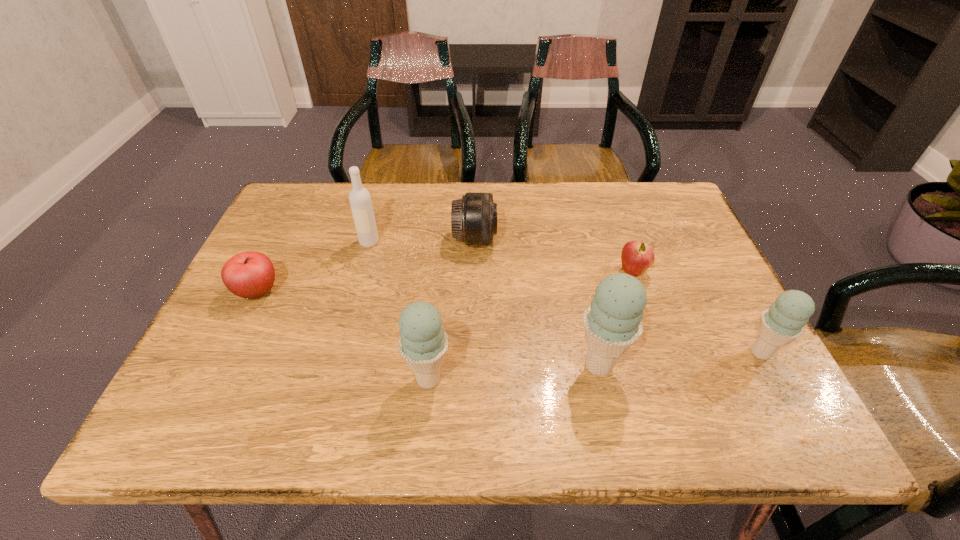
Identify the location of the leftmost ice cream. (423, 343).

Identify the location of the second ice cream from left to right. This screenshot has width=960, height=540. (612, 323).

The image size is (960, 540). In order to click on the rightmost ice cream in this screenshot , I will do `click(784, 321)`.

Identify the location of the rightmost object. (784, 321).

Locate an element on the screen. The height and width of the screenshot is (540, 960). the sixth object from right to left is located at coordinates click(x=360, y=200).

At what (x,y) coordinates should I click in order to perform the action: click on the fifth tallest object. Please return your answer as a coordinate pair (x, y). The image size is (960, 540). Looking at the image, I should click on (474, 217).

Where is `the leftmost object`? Image resolution: width=960 pixels, height=540 pixels. the leftmost object is located at coordinates (251, 274).

Where is `the second object from right to left`? This screenshot has width=960, height=540. the second object from right to left is located at coordinates (637, 256).

This screenshot has height=540, width=960. I want to click on vacant region located on the left of the leftmost ice cream, so click(x=381, y=379).

Locate an element on the screen. vacant space located on the right of the second ice cream from right to left is located at coordinates (708, 365).